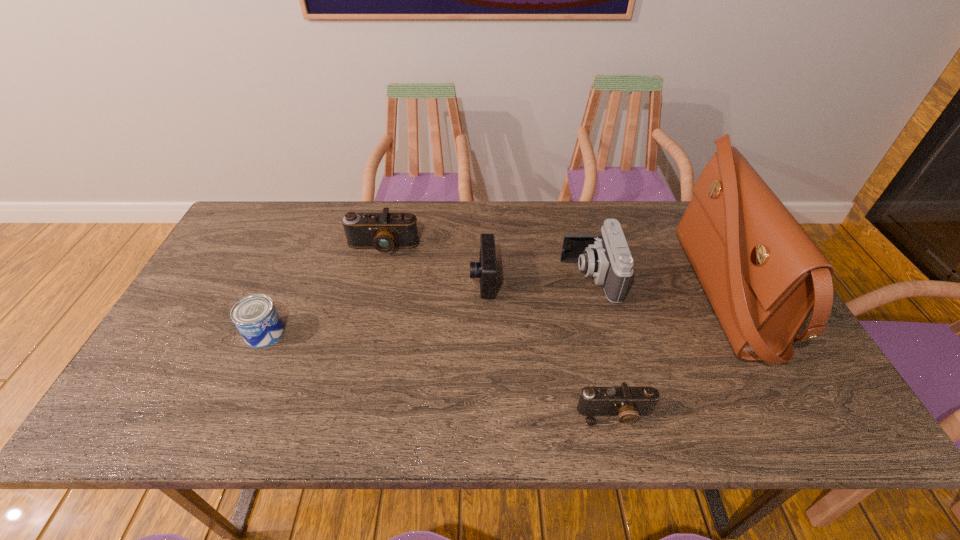
At what (x,y) coordinates should I click in order to perform the action: click on free space located 0.330m on the front flap of the satchel. Please return your answer as a coordinate pair (x, y). This screenshot has height=540, width=960. Looking at the image, I should click on (566, 294).

Find the location of `vacant space located at the front of the fifth shortest object with an open lens cover`. vacant space located at the front of the fifth shortest object with an open lens cover is located at coordinates (524, 277).

Where is `vacant space located 0.090m at the front of the fifth shortest object with an open lens cover`? vacant space located 0.090m at the front of the fifth shortest object with an open lens cover is located at coordinates (531, 277).

You are a GUI agent. You are given a task and a screenshot of the screen. Output one action in this format:
    pyautogui.click(x=<x>, y=<y>)
    Task: Click on the blank space located 0.140m at the front of the fifth shortest object with an open lens cover
    
    Given the screenshot: What is the action you would take?
    pyautogui.click(x=514, y=277)

This screenshot has width=960, height=540. Identify the location of vacant area situated 0.320m on the front-facing side of the fourth object from right to left. (358, 280).

This screenshot has width=960, height=540. Find the location of `blank area located on the front-facing side of the fourth object from right to left`. blank area located on the front-facing side of the fourth object from right to left is located at coordinates [369, 280].

Locate an element on the screen. This screenshot has width=960, height=540. free region located on the front-facing side of the fourth object from right to left is located at coordinates (341, 280).

The width and height of the screenshot is (960, 540). Find the location of `free space located on the lens of the second object from left to right`. free space located on the lens of the second object from left to right is located at coordinates (353, 372).

At what (x,y) coordinates should I click in order to perform the action: click on free space located on the front label of the leftmost object. Please return your answer as a coordinate pair (x, y). The height and width of the screenshot is (540, 960). Looking at the image, I should click on (371, 333).

You are a GUI agent. You are given a task and a screenshot of the screen. Output one action in this format:
    pyautogui.click(x=<x>, y=<y>)
    Task: Click on the satchel positioned at the far edge
    
    Given the screenshot: What is the action you would take?
    pyautogui.click(x=763, y=274)